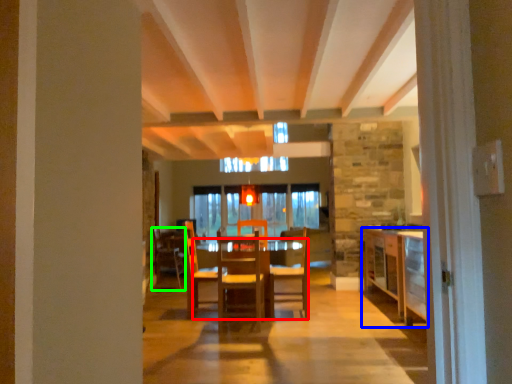
Question: Considering the real-world distances, which object is farthest from table (highlighted by a red box)? cabinetry (highlighted by a blue box) or chair (highlighted by a green box)?

Choices:
 (A) cabinetry
 (B) chair

Answer: (B)